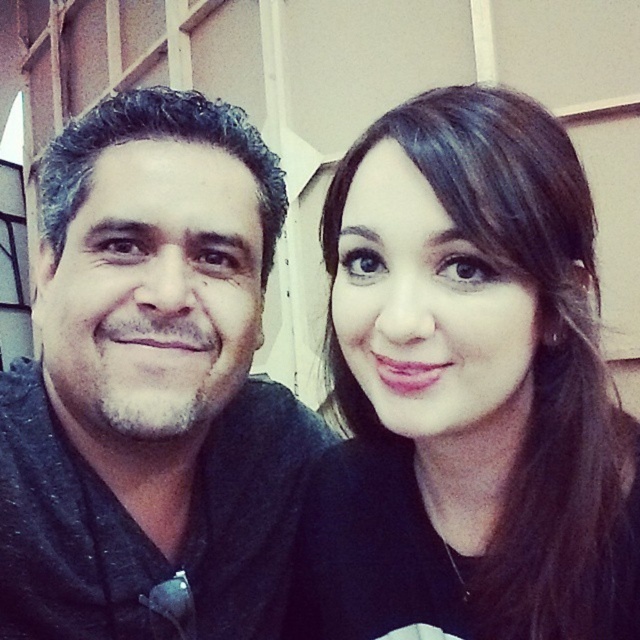
Question: Which object appears closest to the camera in this image?

Choices:
 (A) dark gray fabric shirt at left
 (B) black matte hair at upper right

Answer: (B)

Question: Observing the image, what is the correct spatial positioning of black matte hair at upper right in reference to dark gray fabric shirt at left?

Choices:
 (A) left
 (B) right

Answer: (B)

Question: Which object is farther from the camera taking this photo?

Choices:
 (A) black matte hair at upper right
 (B) dark gray fabric shirt at left

Answer: (B)

Question: Which object is closer to the camera taking this photo?

Choices:
 (A) black matte hair at upper right
 (B) dark gray fabric shirt at left

Answer: (A)

Question: Can you confirm if black matte hair at upper right is positioned above dark gray fabric shirt at left?

Choices:
 (A) no
 (B) yes

Answer: (A)

Question: Can you confirm if black matte hair at upper right is positioned to the left of dark gray fabric shirt at left?

Choices:
 (A) no
 (B) yes

Answer: (A)